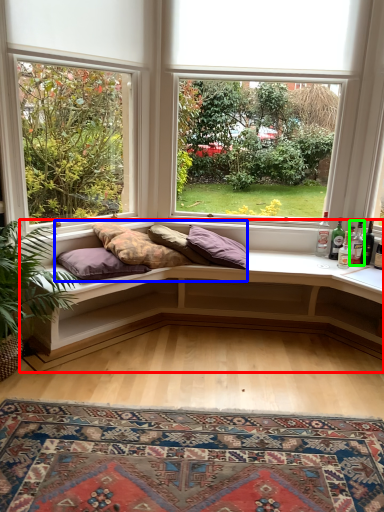
Question: Estimate the real-world distances between objects in this image. Which object is farther from studio couch (highlighted by a red box), bedding (highlighted by a blue box) or bottle (highlighted by a green box)?

Choices:
 (A) bedding
 (B) bottle

Answer: (B)